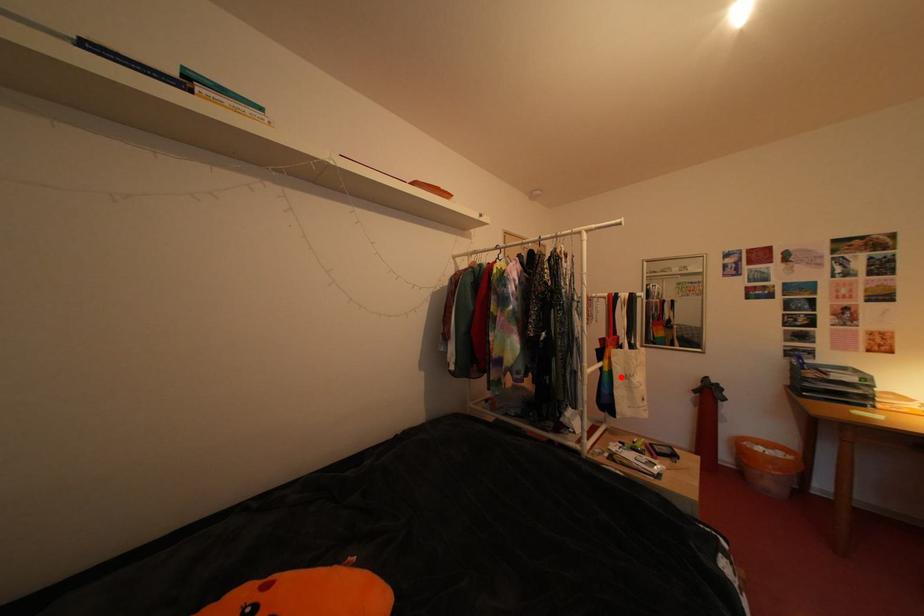
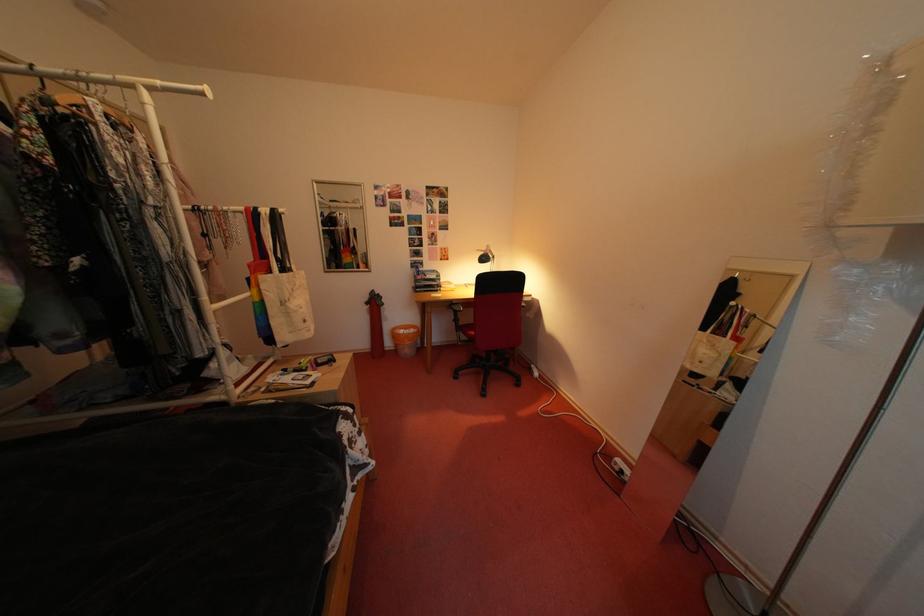
Question: I am providing you with two images of the same scene from different viewpoints. In image1, a red point is highlighted. Considering the same 3D point in image2, which of the following is correct?

Choices:
 (A) It is closer
 (B) It is farther

Answer: (A)